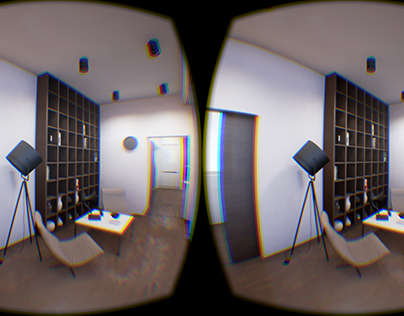
Where is `chairs`? The width and height of the screenshot is (404, 316). chairs is located at coordinates (332, 235), (88, 244).